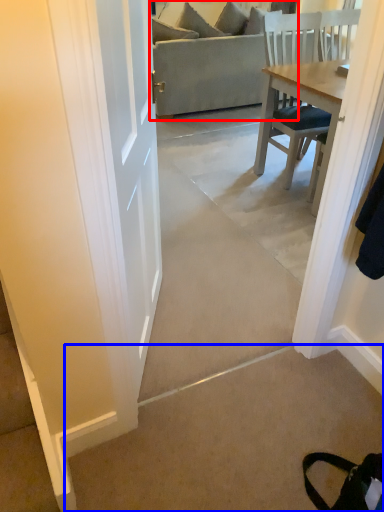
Question: Which object appears farthest to the camera in this image, studio couch (highlighted by a red box) or concrete (highlighted by a blue box)?

Choices:
 (A) studio couch
 (B) concrete

Answer: (A)